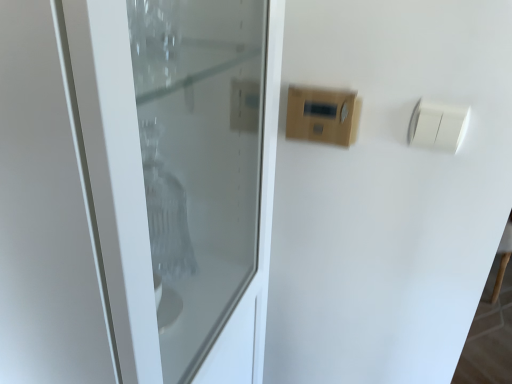
Question: Based on their sizes in the image, would you say white plastic light switch at upper right, the first light switch positioned from the right, is bigger or smaller than white glossy door at center?

Choices:
 (A) small
 (B) big

Answer: (A)

Question: In terms of height, does white plastic light switch at upper right, acting as the 2th light switch starting from the left, look taller or shorter compared to white glossy door at center?

Choices:
 (A) short
 (B) tall

Answer: (A)

Question: Considering the real-world distances, which object is farthest from the white plastic light switch at upper right, acting as the 2th light switch starting from the left?

Choices:
 (A) wooden panel at upper center, which is the second light switch in right-to-left order
 (B) white glossy door at center

Answer: (B)

Question: Which of these objects is positioned farthest from the white plastic light switch at upper right, the first light switch positioned from the right?

Choices:
 (A) wooden panel at upper center, placed as the first light switch when sorted from left to right
 (B) white glossy door at center

Answer: (B)